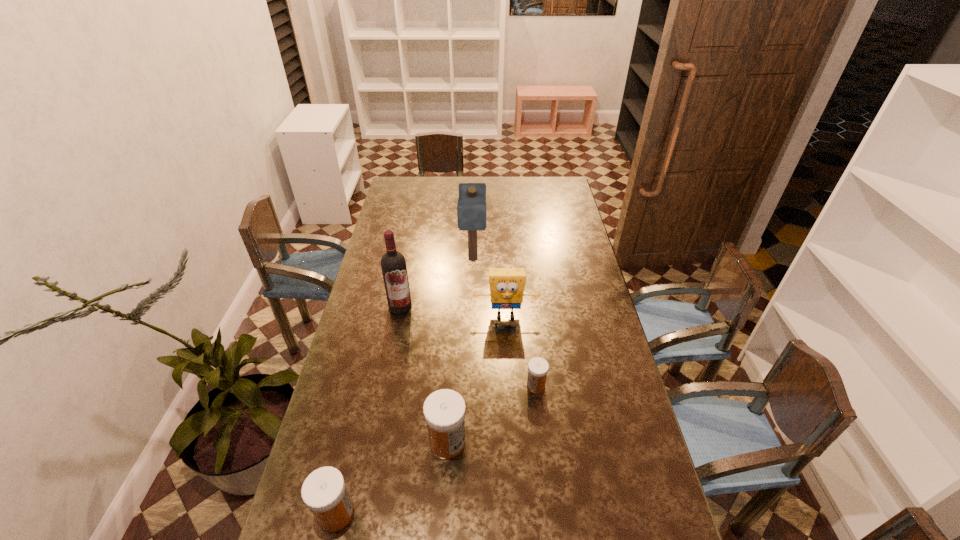
The image size is (960, 540). Find the location of `free point located 0.250m on the left of the second medicine from right to left`. free point located 0.250m on the left of the second medicine from right to left is located at coordinates (340, 442).

The image size is (960, 540). Identify the location of vacant space located 0.110m on the back of the rightmost medicine. (532, 350).

Find the location of a particular element. The height and width of the screenshot is (540, 960). vacant area situated on the label of the wine bottle is located at coordinates 390,360.

Locate an element on the screen. This screenshot has width=960, height=540. free spot located on the right of the mallet is located at coordinates (505, 259).

This screenshot has height=540, width=960. In order to click on free spot located on the face of the sponge in this screenshot , I will do click(x=509, y=370).

Find the location of a particular element. The width and height of the screenshot is (960, 540). object situated at the near edge is located at coordinates (324, 492).

You are a GUI agent. You are given a task and a screenshot of the screen. Output one action in this format:
    pyautogui.click(x=<x>, y=<y>)
    Task: Click on the medicine that is at the left edge
    
    Given the screenshot: What is the action you would take?
    pyautogui.click(x=324, y=492)

Where is `wine bottle present at the left edge`? The image size is (960, 540). wine bottle present at the left edge is located at coordinates (393, 264).

I want to click on object that is at the near left corner, so click(x=324, y=492).

In order to click on vacant space at the far edge of the desktop in this screenshot , I will do `click(444, 197)`.